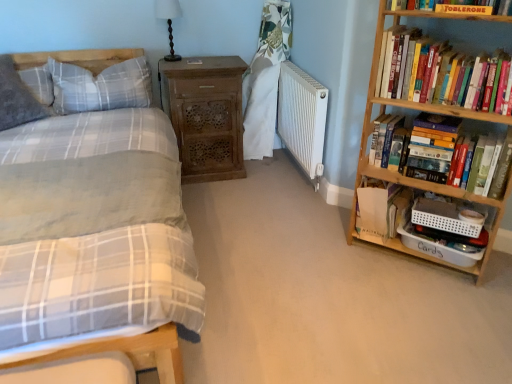
Question: From a real-world perspective, relative to white fabric curtain at center, is soft gray pillow at upper left, the 2th pillow viewed from the right, vertically above or below?

Choices:
 (A) below
 (B) above

Answer: (B)

Question: Considering their positions, is soft gray pillow at upper left, placed as the 1th pillow when sorted from left to right, located in front of or behind white fabric curtain at center?

Choices:
 (A) behind
 (B) front

Answer: (B)

Question: Based on their relative distances, which object is farther from the white fabric curtain at center?

Choices:
 (A) wooden bookshelf at right
 (B) hardcover books at right, the second book from the bottom
 (C) matte plaid bed at left
 (D) black wood table lamp at upper center
 (E) matte yellow paperback book at upper right

Answer: (E)

Question: Estimate the real-world distances between objects in this image. Which object is farther from the hardcover books at right, the second book from the bottom?

Choices:
 (A) matte yellow paperback book at upper right
 (B) white fabric curtain at center
 (C) wooden carved nightstand at left
 (D) soft gray pillow at upper left, the 2th pillow viewed from the right
 (E) black wood table lamp at upper center

Answer: (D)